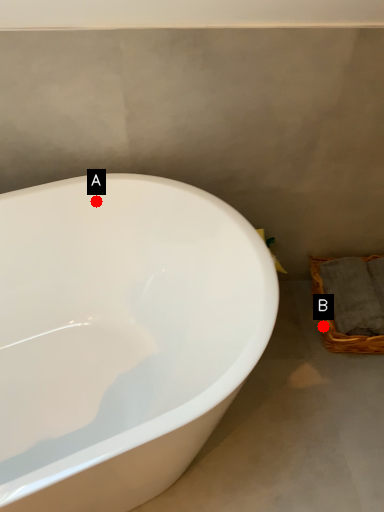
Question: Two points are circled on the image, labeled by A and B beside each circle. Among these points, which one is nearest to the camera?

Choices:
 (A) A is closer
 (B) B is closer

Answer: (A)